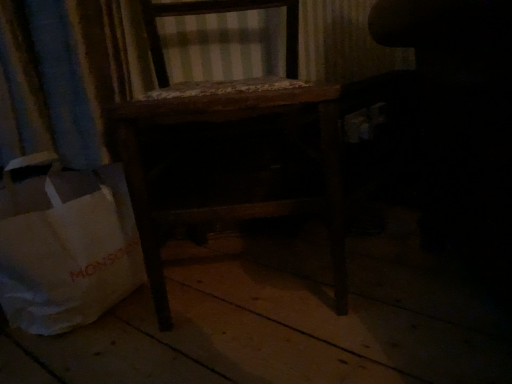
Question: From a real-world perspective, relative to white paper bag at lower left, is dark fabric swivel chair at right vertically above or below?

Choices:
 (A) below
 (B) above

Answer: (B)

Question: Is dark fabric swivel chair at right taller or shorter than white paper bag at lower left?

Choices:
 (A) tall
 (B) short

Answer: (A)

Question: Based on their relative distances, which object is farther from the wooden chair at center?

Choices:
 (A) dark fabric swivel chair at right
 (B) white paper bag at lower left

Answer: (A)

Question: Which object is the closest to the white paper bag at lower left?

Choices:
 (A) wooden chair at center
 (B) dark fabric swivel chair at right

Answer: (A)